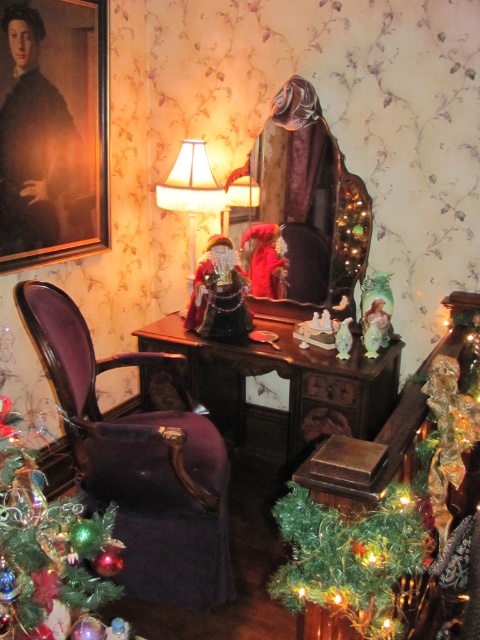
You are an interior designer planning to place a new 30 cm wide decorative item between the matte black portrait at upper left and the matte cream lampshade at center. Can both objects remain visible without overlapping?

The distance between the matte black portrait at upper left and the matte cream lampshade at center is 50.41 centimeters. Since the decorative item is only 30 cm wide, there is enough space to place it between them without overlapping either object.

You are planning to decorate a similar festive scene and have both the shiny green garland at center and the shiny green plastic tree at lower right. Which object should you place first if you want to ensure there is enough space for both?

You should place the shiny green garland at center first because it has a larger size compared to the shiny green plastic tree at lower right, ensuring there is enough space for both.